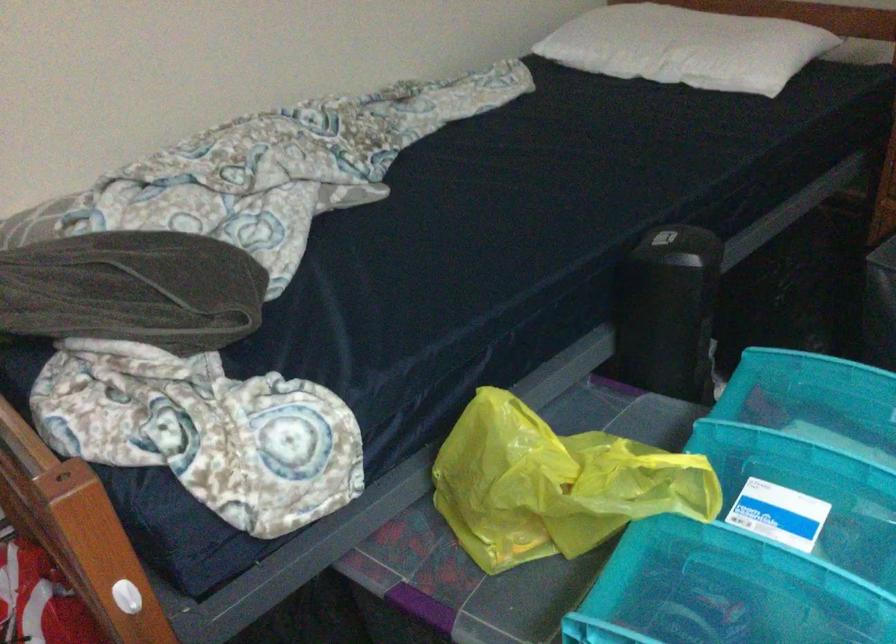
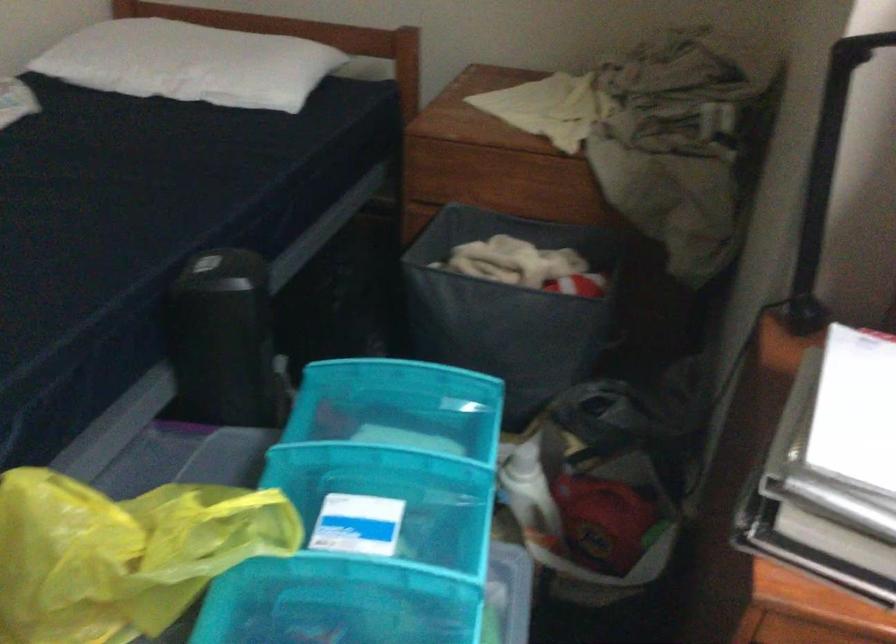
Question: The camera is either moving clockwise (left) or counter-clockwise (right) around the object. The first image is from the beginning of the video and the second image is from the end. Is the camera moving left or right when shooting the video?

Choices:
 (A) Left
 (B) Right

Answer: (A)